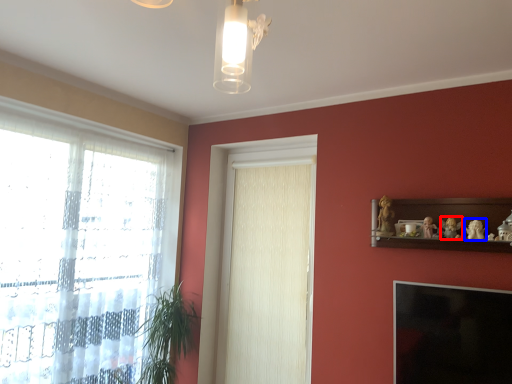
Question: Which object appears closest to the camera in this image, toy (highlighted by a red box) or toy (highlighted by a blue box)?

Choices:
 (A) toy
 (B) toy

Answer: (B)